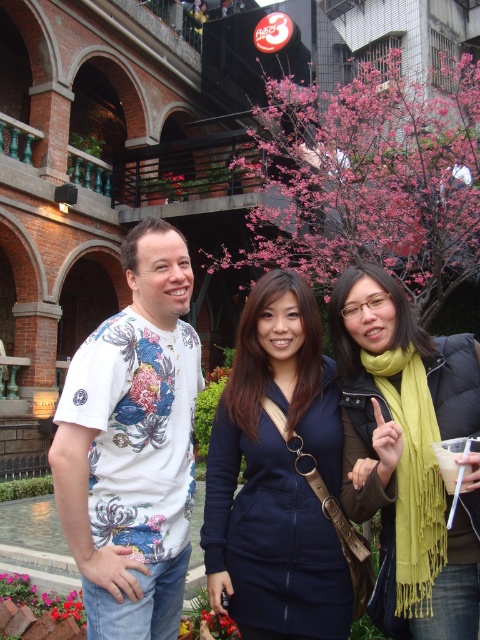
You are a photographer trying to capture the group of three individuals in the scene. You notice a point at coordinate (132, 445) which corresponds to the white floral t shirt at left. If you want to ensure that the white floral t shirt at left is in focus, where should you position your camera focus point?

The white floral t shirt at left is represented by point (132, 445), so you should position your camera focus point at that coordinate to ensure it is in focus.

You are standing at the point with coordinates (409,445) in the image. What object is located exactly at that point?

The green scarf at center is located exactly at point (409,445).